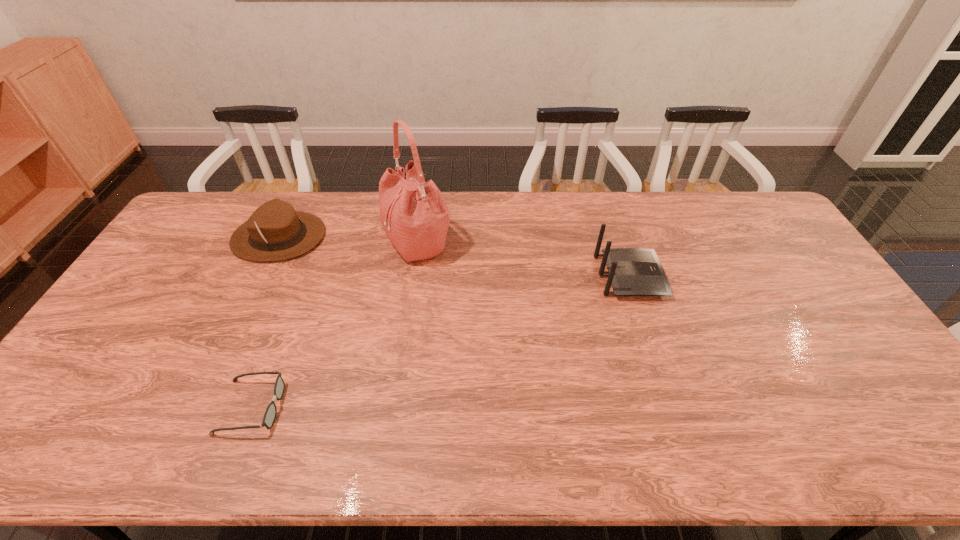
At what (x,y) coordinates should I click in order to perform the action: click on blank area in the image that satisfies the following two spatial constraints: 1. on the back side of the handbag; 2. on the feather side of the fedora. Please return your answer as a coordinate pair (x, y). The height and width of the screenshot is (540, 960). Looking at the image, I should click on (419, 237).

Where is `free spot that satisfies the following two spatial constraints: 1. on the front side of the third object from left to right; 2. on the front-facing side of the rightmost object`? The image size is (960, 540). free spot that satisfies the following two spatial constraints: 1. on the front side of the third object from left to right; 2. on the front-facing side of the rightmost object is located at coordinates (413, 276).

Locate an element on the screen. free region that satisfies the following two spatial constraints: 1. on the feather side of the fedora; 2. on the back side of the second object from right to left is located at coordinates (276, 242).

Locate an element on the screen. The height and width of the screenshot is (540, 960). free space in the image that satisfies the following two spatial constraints: 1. on the back side of the second object from right to left; 2. on the feather side of the fedora is located at coordinates (419, 237).

The width and height of the screenshot is (960, 540). I want to click on free space that satisfies the following two spatial constraints: 1. on the front-facing side of the router; 2. on the feather side of the fedora, so click(x=616, y=237).

Where is `vacant space that satisfies the following two spatial constraints: 1. on the front-facing side of the router; 2. on the front side of the third object from left to right`? The image size is (960, 540). vacant space that satisfies the following two spatial constraints: 1. on the front-facing side of the router; 2. on the front side of the third object from left to right is located at coordinates (618, 242).